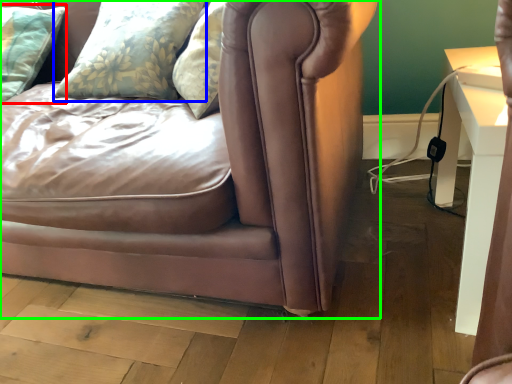
Question: Which is farther away from pillow (highlighted by a red box)? pillow (highlighted by a blue box) or studio couch (highlighted by a green box)?

Choices:
 (A) pillow
 (B) studio couch

Answer: (B)